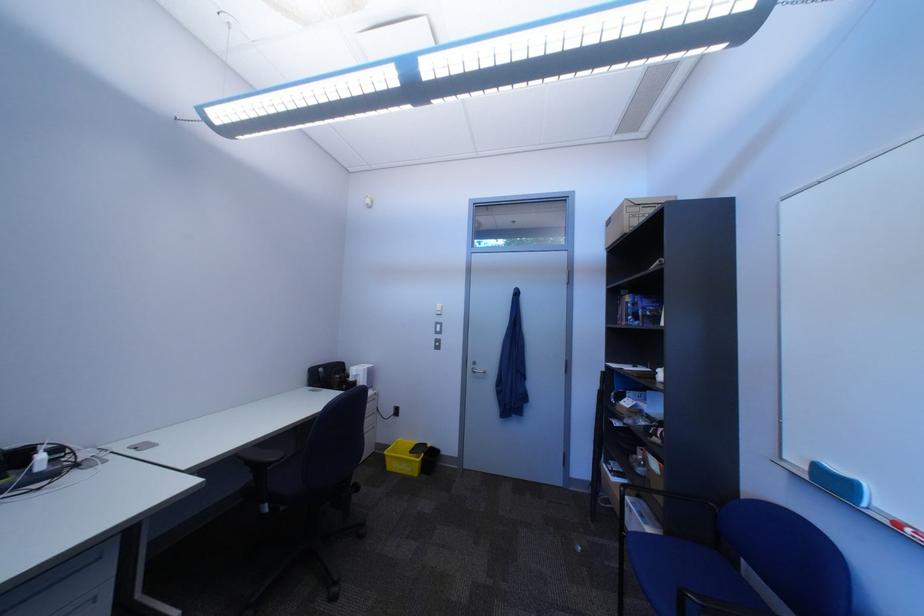
Which object does [404,456] point to?

This point indicates the cardboard storage box.